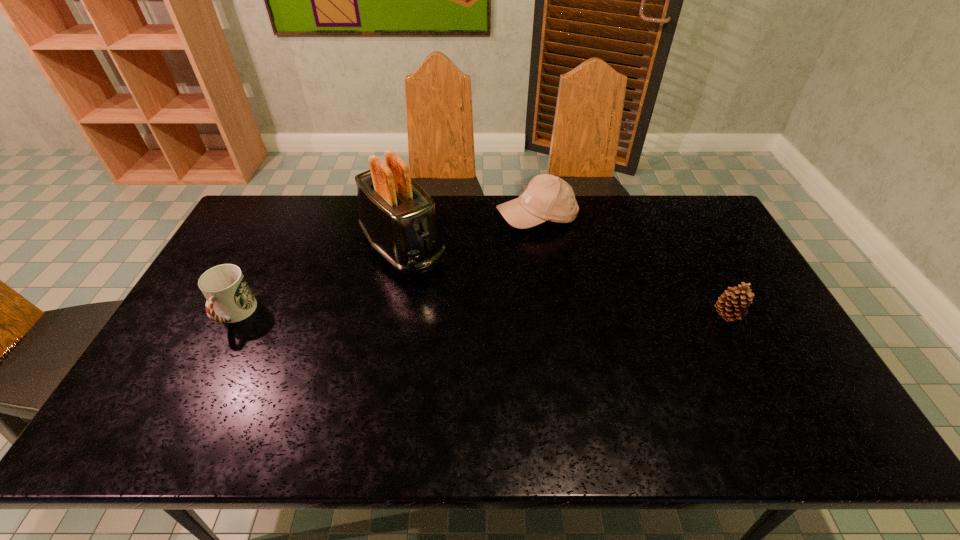
In order to click on free point at the right edge in this screenshot , I will do `click(746, 269)`.

The width and height of the screenshot is (960, 540). I want to click on vacant space at the far left corner of the desktop, so click(267, 214).

Find the location of a particular element. This screenshot has width=960, height=540. free region at the far right corner of the desktop is located at coordinates (702, 202).

Locate an element on the screen. free space between the second object from right to left and the second object from left to right is located at coordinates (469, 232).

Where is `free space between the third object from left to right and the rightmost object`? The width and height of the screenshot is (960, 540). free space between the third object from left to right and the rightmost object is located at coordinates (632, 266).

You are a GUI agent. You are given a task and a screenshot of the screen. Output one action in this format:
    pyautogui.click(x=<x>, y=<y>)
    Task: Click on the empty space between the tallest object and the cup
    The height and width of the screenshot is (540, 960).
    Given the screenshot: What is the action you would take?
    pyautogui.click(x=319, y=281)

The height and width of the screenshot is (540, 960). In order to click on free space that is in between the baseball cap and the second object from left to right in this screenshot , I will do `click(469, 232)`.

Identify the location of free space between the second object from left to right and the cup. Image resolution: width=960 pixels, height=540 pixels. (319, 281).

This screenshot has height=540, width=960. What are the coordinates of `vacant point located between the cup and the toaster` in the screenshot? It's located at coord(319,281).

This screenshot has height=540, width=960. I want to click on vacant area between the rightmost object and the tallest object, so click(564, 281).